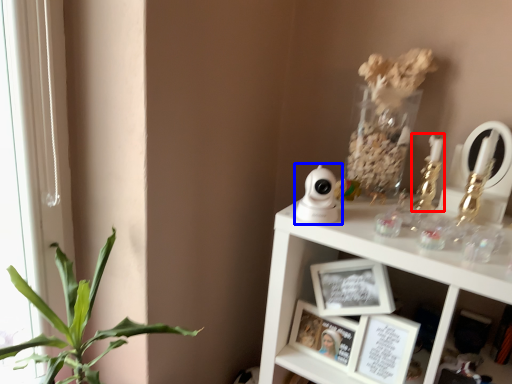
Question: Which point is further to the camera, candle holder (highlighted by a red box) or toy (highlighted by a blue box)?

Choices:
 (A) candle holder
 (B) toy

Answer: (A)